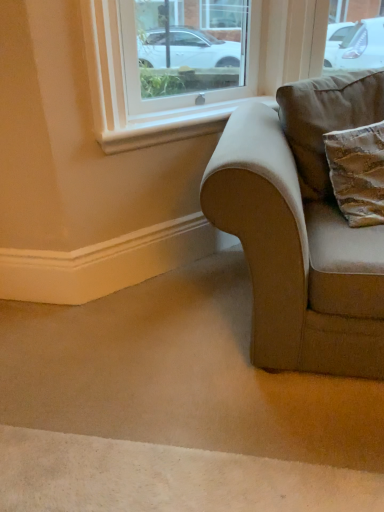
Question: From a real-world perspective, is white smooth window sill at upper center below brown suede pillow at right?

Choices:
 (A) no
 (B) yes

Answer: (B)

Question: From the image's perspective, is white smooth window sill at upper center below brown suede pillow at right?

Choices:
 (A) yes
 (B) no

Answer: (B)

Question: Considering the relative positions of white smooth window sill at upper center and brown suede pillow at right in the image provided, is white smooth window sill at upper center behind brown suede pillow at right?

Choices:
 (A) yes
 (B) no

Answer: (A)

Question: Is brown suede pillow at right located within white smooth window sill at upper center?

Choices:
 (A) no
 (B) yes

Answer: (A)

Question: Is white smooth window sill at upper center aimed at brown suede pillow at right?

Choices:
 (A) yes
 (B) no

Answer: (A)

Question: Looking at the image, does white smooth window sill at upper center seem bigger or smaller compared to velvet beige couch at lower right?

Choices:
 (A) small
 (B) big

Answer: (A)

Question: Considering their positions, is white smooth window sill at upper center located in front of or behind velvet beige couch at lower right?

Choices:
 (A) behind
 (B) front

Answer: (A)

Question: Is point (203, 119) positioned closer to the camera than point (352, 84)?

Choices:
 (A) farther
 (B) closer

Answer: (A)

Question: Would you say white smooth window sill at upper center is to the left or to the right of velvet beige couch at lower right in the picture?

Choices:
 (A) left
 (B) right

Answer: (A)

Question: Looking at the image, does velvet beige couch at lower right seem bigger or smaller compared to brown suede pillow at right?

Choices:
 (A) big
 (B) small

Answer: (A)

Question: Considering the positions of velvet beige couch at lower right and brown suede pillow at right in the image, is velvet beige couch at lower right wider or thinner than brown suede pillow at right?

Choices:
 (A) thin
 (B) wide

Answer: (B)

Question: Based on their positions, is velvet beige couch at lower right located to the left or right of brown suede pillow at right?

Choices:
 (A) right
 (B) left

Answer: (B)

Question: Is velvet beige couch at lower right inside the boundaries of brown suede pillow at right, or outside?

Choices:
 (A) outside
 (B) inside

Answer: (A)

Question: Is velvet beige couch at lower right wider or thinner than white smooth window sill at upper center?

Choices:
 (A) thin
 (B) wide

Answer: (B)

Question: Considering the positions of point (301, 80) and point (157, 130), is point (301, 80) closer or farther from the camera than point (157, 130)?

Choices:
 (A) closer
 (B) farther

Answer: (A)